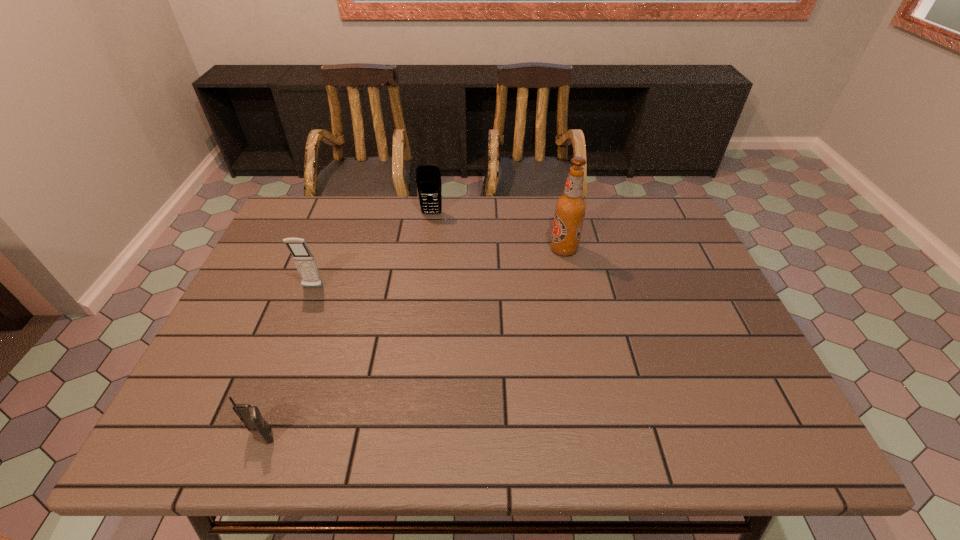
The height and width of the screenshot is (540, 960). I want to click on free space located on the front-facing side of the third farthest object, so click(x=273, y=393).

At what (x,y) coordinates should I click in order to perform the action: click on vacant space located 0.180m on the screen of the farthest cellular telephone. Please return your answer as a coordinate pair (x, y). Looking at the image, I should click on (426, 254).

The image size is (960, 540). In order to click on beer bottle that is at the far edge in this screenshot , I will do `click(570, 208)`.

Find the location of a particular element. The width and height of the screenshot is (960, 540). cellular telephone that is at the far edge is located at coordinates (428, 178).

Where is `object at the near edge`? object at the near edge is located at coordinates (250, 415).

I want to click on object at the near left corner, so click(250, 415).

Locate an element on the screen. The image size is (960, 540). vacant region at the far edge of the desktop is located at coordinates (616, 213).

Where is `free region at the near edge of the desktop`? Image resolution: width=960 pixels, height=540 pixels. free region at the near edge of the desktop is located at coordinates (368, 438).

Identify the location of free location at the left edge. This screenshot has width=960, height=540. (262, 310).

I want to click on vacant space at the right edge, so click(709, 359).